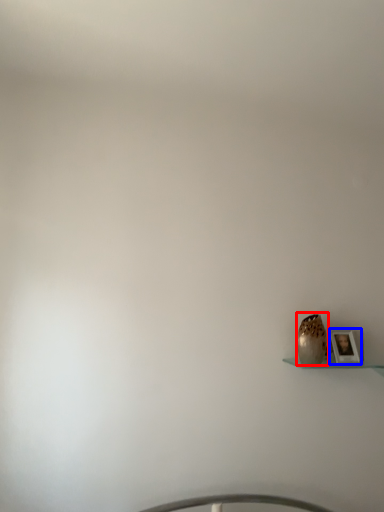
Question: Which object is further to the camera taking this photo, vase (highlighted by a red box) or picture frame (highlighted by a blue box)?

Choices:
 (A) vase
 (B) picture frame

Answer: (B)